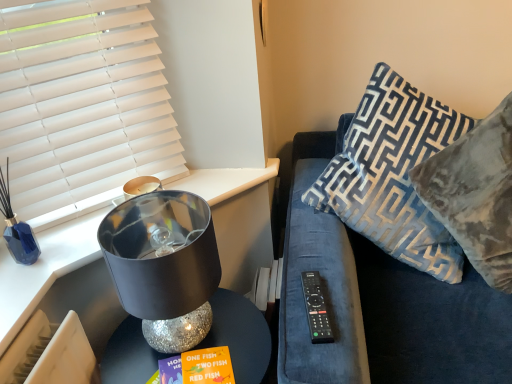
Question: Looking at their shapes, would you say sparkly silver table at lower left is wider or thinner than shiny metallic lampshade at left?

Choices:
 (A) wide
 (B) thin

Answer: (A)

Question: Relative to shiny metallic lampshade at left, is sparkly silver table at lower left in front or behind?

Choices:
 (A) front
 (B) behind

Answer: (B)

Question: Which object is the closest to the blue velvet pillow at right, acting as the second pillow starting from the right?

Choices:
 (A) shiny metallic lampshade at left
 (B) shiny metallic lamp at left
 (C) velvet blue pillow at upper right, which appears as the 2th pillow when viewed from the left
 (D) black plastic remote at right
 (E) white matte window blind at upper left

Answer: (C)

Question: Considering the real-world distances, which object is closest to the sparkly silver table at lower left?

Choices:
 (A) velvet blue couch at right
 (B) shiny metallic lamp at left
 (C) black plastic remote at right
 (D) shiny metallic lampshade at left
 (E) white matte window blind at upper left

Answer: (D)